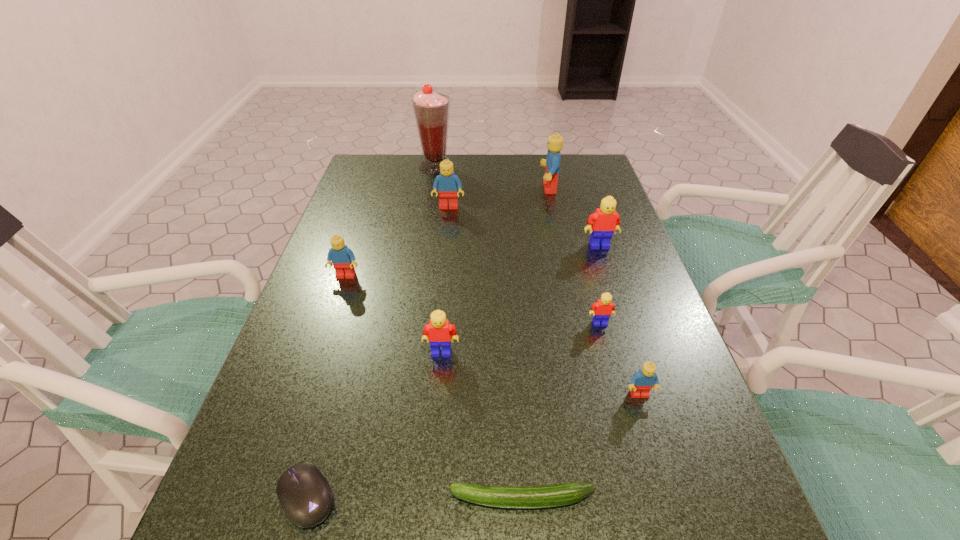
Locate an element on the screen. This screenshot has width=960, height=540. vacant region located 0.180m on the face of the farthest Lego is located at coordinates [484, 188].

Identify the location of blank space located on the face of the farthest Lego. Image resolution: width=960 pixels, height=540 pixels. (449, 188).

The width and height of the screenshot is (960, 540). Find the location of `free space located on the face of the farthest Lego`. free space located on the face of the farthest Lego is located at coordinates (502, 188).

This screenshot has height=540, width=960. What are the coordinates of `vacant space situated 0.130m on the face of the third smallest blue Lego` in the screenshot? It's located at (445, 238).

This screenshot has width=960, height=540. In order to click on free space located 0.280m on the front-facing side of the seventh nearest object in this screenshot , I will do click(x=627, y=329).

This screenshot has height=540, width=960. Identify the location of free point located on the face of the sixth nearest object. (310, 381).

Where is `vacant point located on the front-facing side of the second nearest Lego`? The width and height of the screenshot is (960, 540). vacant point located on the front-facing side of the second nearest Lego is located at coordinates (439, 382).

Where is `vacant space located on the front-facing side of the third nearest Lego`? The image size is (960, 540). vacant space located on the front-facing side of the third nearest Lego is located at coordinates (625, 417).

You are a GUI agent. You are given a task and a screenshot of the screen. Output one action in this format:
    pyautogui.click(x=<x>, y=<y>)
    Task: Click on the free space located on the face of the eighth farthest object
    
    Given the screenshot: What is the action you would take?
    pyautogui.click(x=657, y=451)

Find the location of a particular element. The height and width of the screenshot is (540, 960). vacant region located 0.090m on the back of the second shortest object is located at coordinates (329, 416).